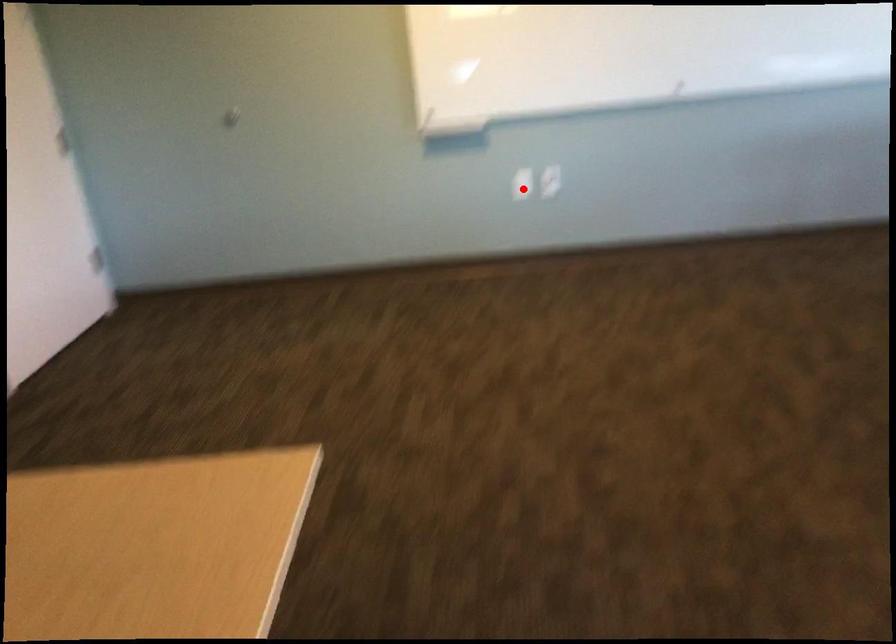
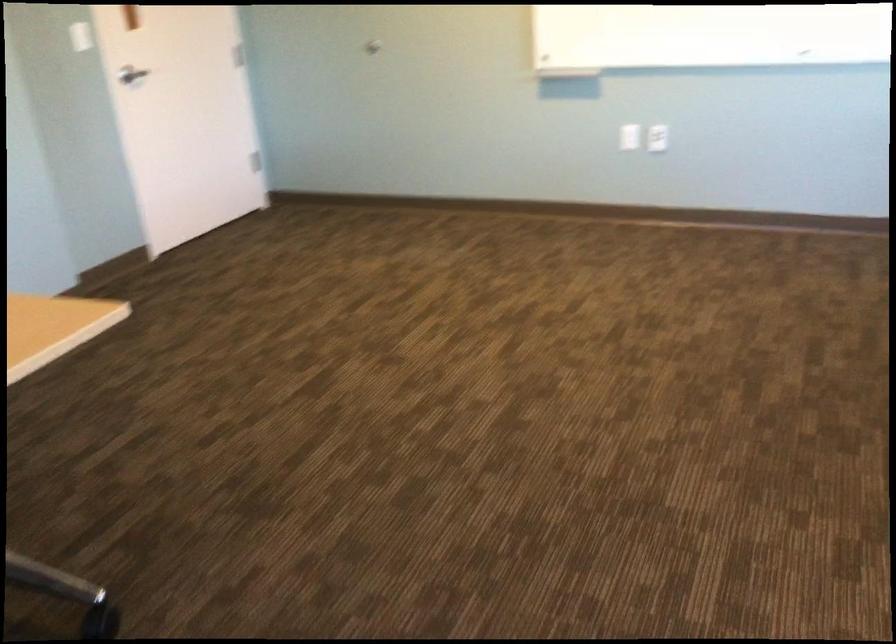
Locate, in the second image, the point that corresponds to the highlighted location in the first image.

(629, 137)